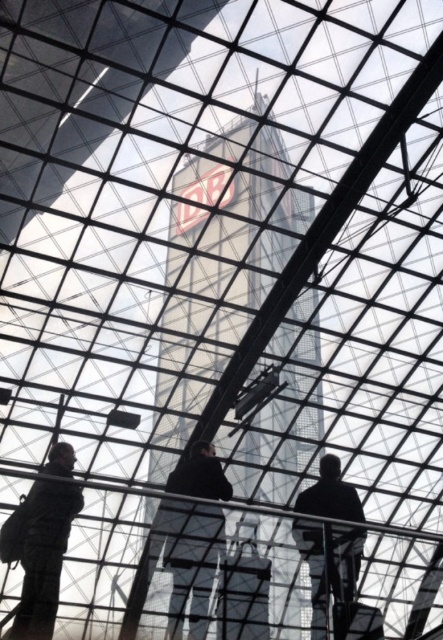
Question: Can you confirm if silhouette figure at lower left is positioned below black matte person at lower right?

Choices:
 (A) no
 (B) yes

Answer: (A)

Question: Which point is closer to the camera?

Choices:
 (A) (57, 504)
 (B) (345, 556)
 (C) (233, 525)

Answer: (A)

Question: Can you confirm if transparent glass tower at center is positioned to the left of black matte person at lower right?

Choices:
 (A) no
 (B) yes

Answer: (B)

Question: Which point appears farthest from the camera in this image?

Choices:
 (A) (18, 605)
 (B) (167, 561)
 (C) (333, 536)

Answer: (C)

Question: Observing the image, what is the correct spatial positioning of transparent glass tower at center in reference to black matte person at lower right?

Choices:
 (A) above
 (B) below

Answer: (A)

Question: Which of these objects is positioned closest to the transparent glass tower at center?

Choices:
 (A) dark clothing figure at center
 (B) black matte person at lower right
 (C) silhouette figure at lower left

Answer: (B)